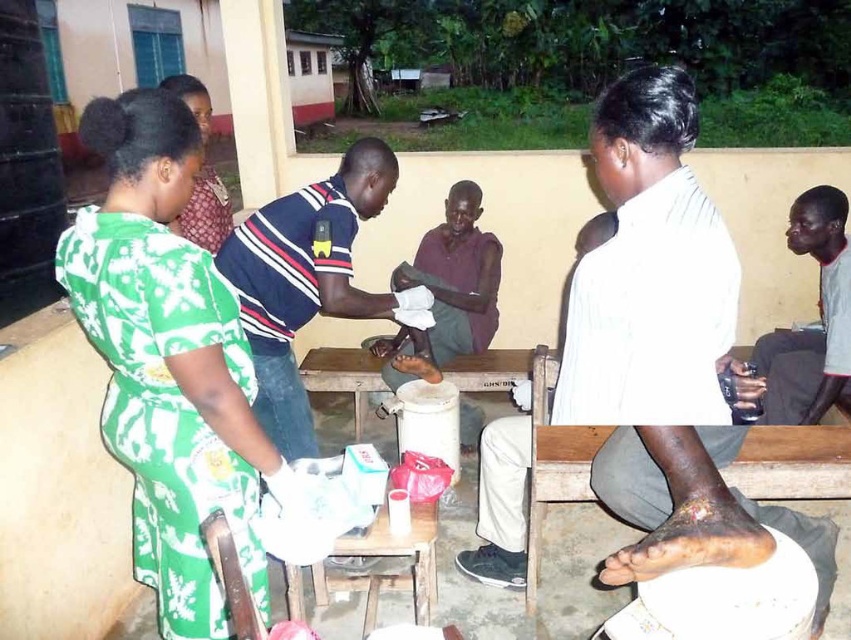
You are a photographer trying to capture a closeup of the foot being treated. The foot is located at point [161,440] and the bench is at point [360,216]. Which point should you focus on to get the foot in focus without the bench obstructing the view?

You should focus on point [161,440] because it is closer to the camera than point [360,216], ensuring the foot is in focus while the bench remains out of the way.

You are a visitor at this clinic and need to place a small first aid kit on either the dark gray fabric shirt at right or the wooden table at center. Considering their heights, which surface would be more stable for placing the kit?

The wooden table at center would be more stable since the dark gray fabric shirt at right is taller but not a solid surface. However, the description states the dark gray fabric shirt at right has a greater height than the wooden table at center, so the table is shorter. Since the table is a solid surface, it remains the better choice despite its lower height.